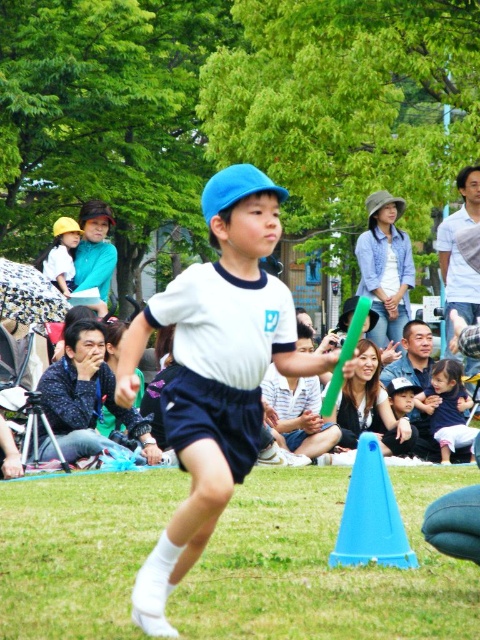
Please look at the image and locate the point at coordinates (87,396). What object is located at that point?

The point at coordinates (87,396) corresponds to the matte black shirt at lower left.

You are a participant in the relay race and see the green grass at lower center and the blue plastic cone at lower center. Which object is positioned to the right of the other?

The green grass at lower center is to the right of the blue plastic cone at lower center.